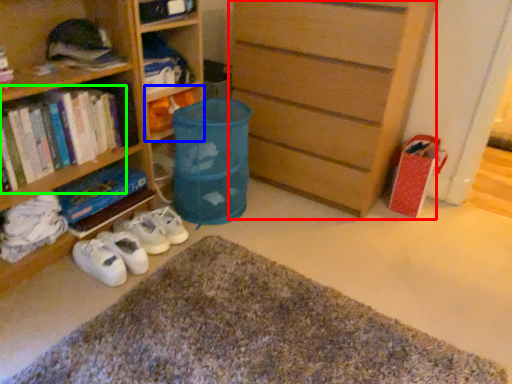
Question: Estimate the real-world distances between objects in this image. Which object is closer to chest of drawers (highlighted by a red box), book (highlighted by a blue box) or book (highlighted by a green box)?

Choices:
 (A) book
 (B) book

Answer: (A)